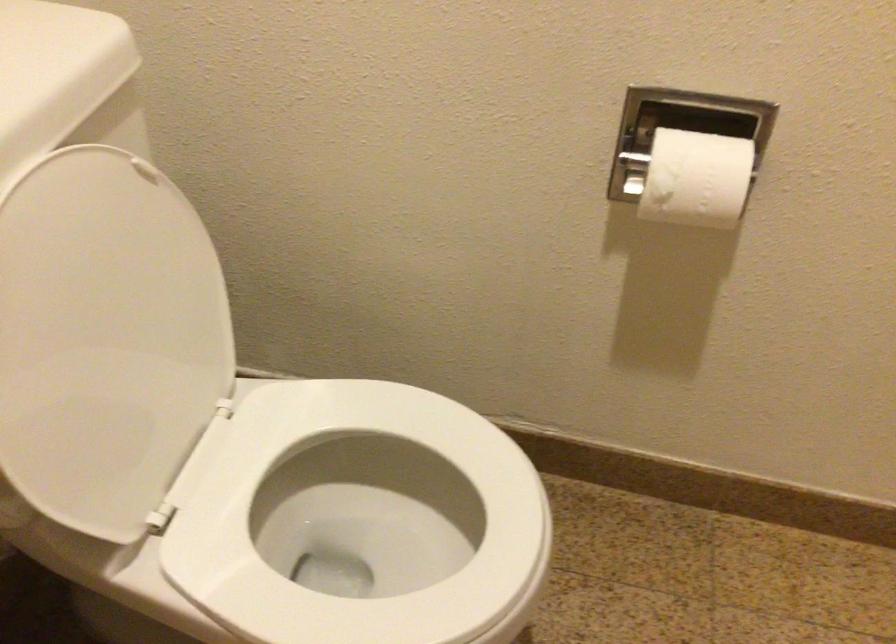
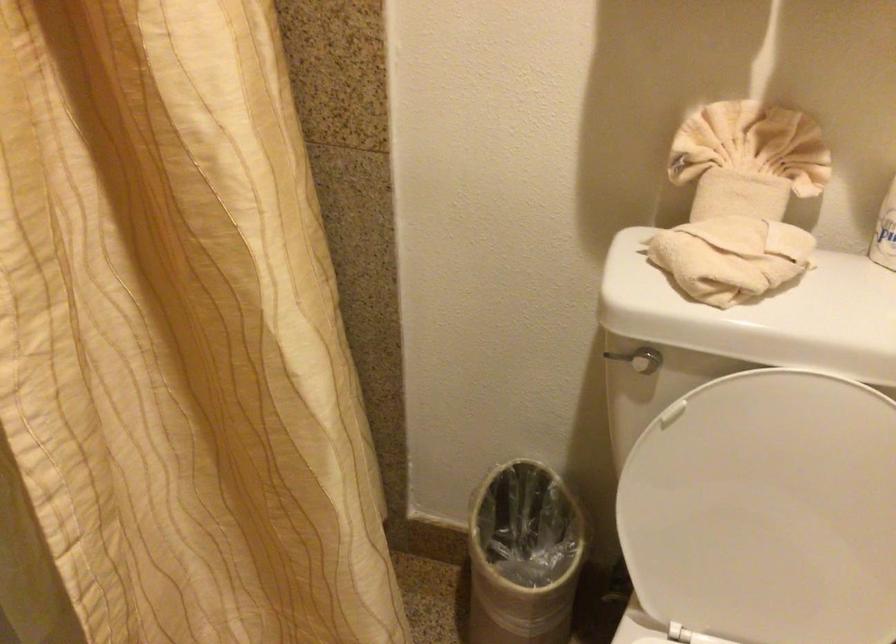
Based on the continuous images, in which direction is the camera rotating?

The rotation direction of the camera is left-down.